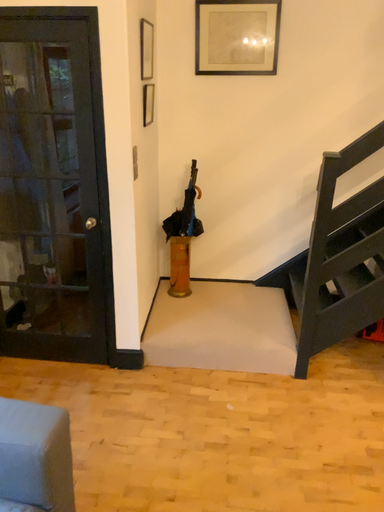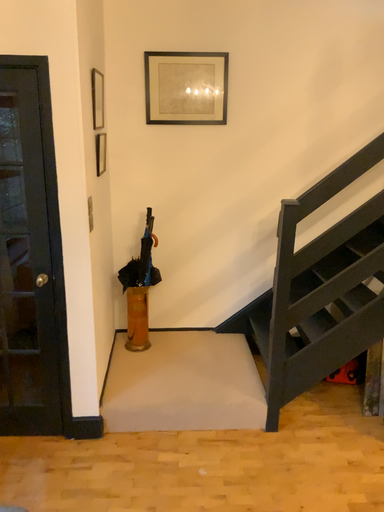
Question: How did the camera likely rotate when shooting the video?

Choices:
 (A) rotated left
 (B) rotated right

Answer: (B)